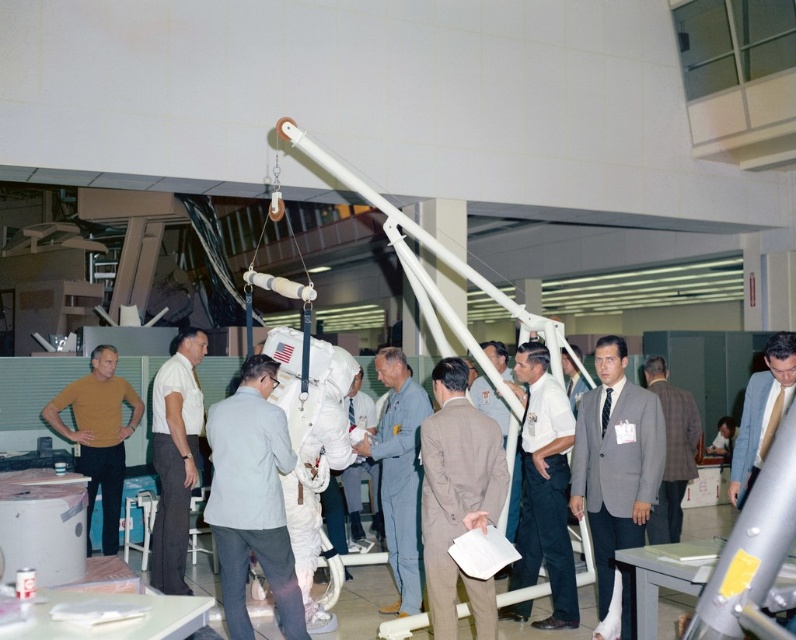
Question: Can you confirm if gray fabric suit at center is positioned to the right of white shirt at center?

Choices:
 (A) no
 (B) yes

Answer: (A)

Question: Does matte yellow shirt at center appear over white fabric spacesuit at center?

Choices:
 (A) yes
 (B) no

Answer: (A)

Question: Which object is positioned closest to the matte yellow shirt at center?

Choices:
 (A) white shirt at center
 (B) gray suit at center
 (C) white fabric spacesuit at center
 (D) gray fabric spacesuit at center

Answer: (C)

Question: Does gray fabric suit at center have a smaller size compared to white fabric spacesuit at center?

Choices:
 (A) no
 (B) yes

Answer: (B)

Question: Which point is farther to the camera?

Choices:
 (A) gray fabric spacesuit at center
 (B) gray suit at center
 (C) white fabric spacesuit at center
 (D) white cotton shirt at center

Answer: (C)

Question: Estimate the real-world distances between objects in this image. Which object is farther from the matte yellow shirt at center?

Choices:
 (A) gray fabric spacesuit at center
 (B) gray suit at center

Answer: (B)